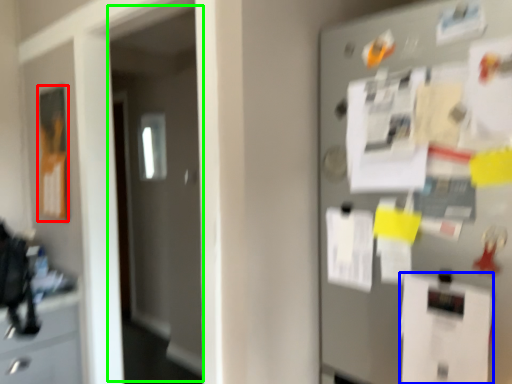
Question: Considering the real-world distances, which object is closest to poster (highlighted by a red box)? paper (highlighted by a blue box) or glass door (highlighted by a green box).

Choices:
 (A) paper
 (B) glass door

Answer: (B)